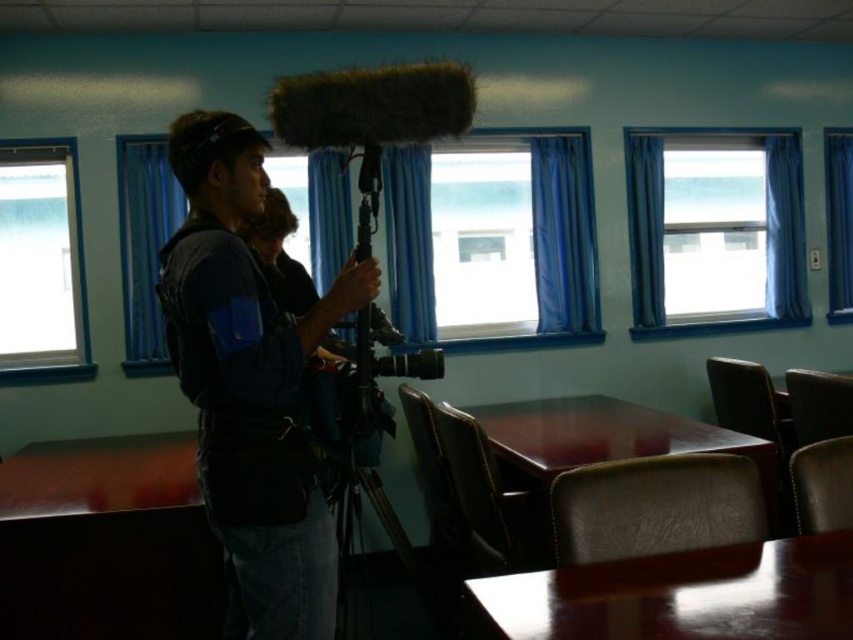
Question: Can you confirm if transparent glass window at left is wider than blue fabric window at center?

Choices:
 (A) no
 (B) yes

Answer: (B)

Question: Considering the relative positions of blue fabric curtain at center and blue fabric window at center in the image provided, where is blue fabric curtain at center located with respect to blue fabric window at center?

Choices:
 (A) below
 (B) above

Answer: (B)

Question: Among these objects, which one is farthest from the camera?

Choices:
 (A) blue fabric curtain at right
 (B) transparent glass window at left
 (C) blue fabric curtain at center

Answer: (A)

Question: Considering the real-world distances, which object is closest to the black matte tripod at center?

Choices:
 (A) blue fabric window at center
 (B) blue curtain at upper right
 (C) transparent glass window at left

Answer: (A)

Question: Which object appears farthest from the camera in this image?

Choices:
 (A) transparent glass window at left
 (B) dark blue fabric vest at center

Answer: (A)

Question: Does blue curtain at upper right have a larger size compared to black matte tripod at center?

Choices:
 (A) no
 (B) yes

Answer: (A)